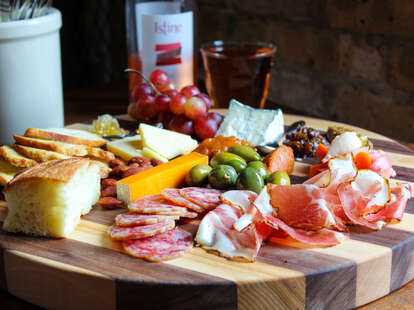
Where is `silverware`? This screenshot has height=310, width=414. silverware is located at coordinates (30, 6).